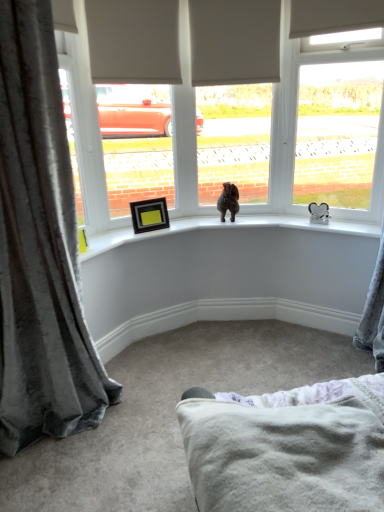
Find the location of a particular element. Image resolution: width=384 pixels, height=512 pixels. vacant space in front of black matte picture frame at upper left is located at coordinates (139, 234).